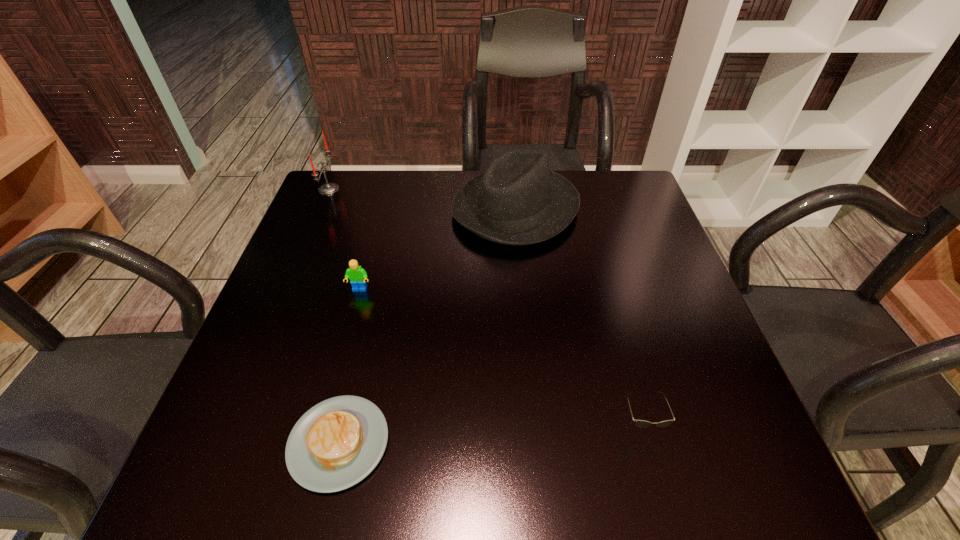
I want to click on free space that satisfies the following two spatial constraints: 1. on the front-facing side of the fedora; 2. on the right side of the leftmost object, so click(321, 209).

Find the location of a particular element. vacant point that satisfies the following two spatial constraints: 1. on the back side of the shortest object; 2. on the left side of the fedora is located at coordinates (393, 209).

Where is `vacant region that satisfies the following two spatial constraints: 1. on the front-facing side of the leftmost object; 2. on the back side of the fedora`? vacant region that satisfies the following two spatial constraints: 1. on the front-facing side of the leftmost object; 2. on the back side of the fedora is located at coordinates 321,209.